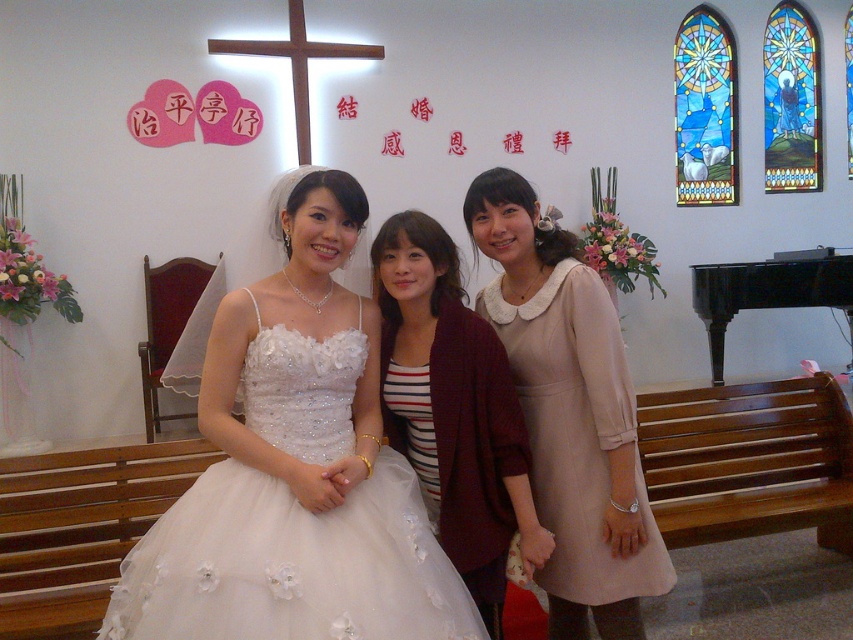
Can you confirm if white tulle dress at center is smaller than black piano at right?

Yes.

Does white tulle dress at center appear over black piano at right?

Incorrect, white tulle dress at center is not positioned above black piano at right.

Is point (334, 509) behind point (689, 266)?

That is False.

Where is `white tulle dress at center`? Image resolution: width=853 pixels, height=640 pixels. white tulle dress at center is located at coordinates (291, 564).

Between point (438, 428) and point (703, 296), which one is positioned behind?

Positioned behind is point (703, 296).

Does point (389, 221) come farther from viewer compared to point (799, 292)?

No, (389, 221) is closer to viewer.

Who is more forward, (489,500) or (712,330)?

Point (489,500) is in front.

I want to click on white satin dress at center, so click(x=453, y=410).

Can you confirm if white satin dress at center is positioned to the left of beige satin dress at center?

Yes, white satin dress at center is to the left of beige satin dress at center.

Is white satin dress at center bigger than beige satin dress at center?

No, white satin dress at center is not bigger than beige satin dress at center.

I want to click on white satin dress at center, so (453, 410).